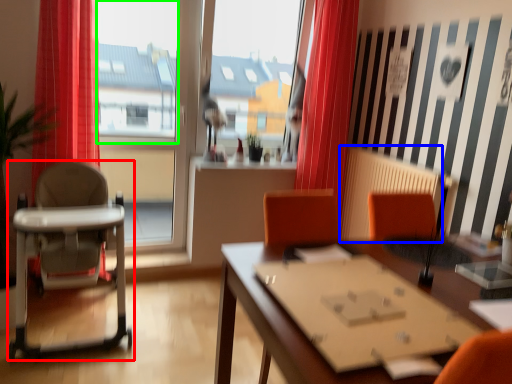
Question: Based on their relative distances, which object is farther from chair (highlighted by a red box)? Choose from radiator (highlighted by a blue box) and window screen (highlighted by a green box).

Choices:
 (A) radiator
 (B) window screen

Answer: (A)